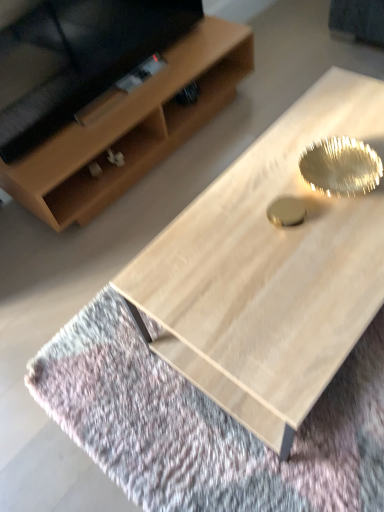
Question: Would you say light brown wood shelf at upper left is inside or outside light wood coffee table at center?

Choices:
 (A) inside
 (B) outside

Answer: (B)

Question: From a real-world perspective, is light brown wood shelf at upper left above or below light wood coffee table at center?

Choices:
 (A) above
 (B) below

Answer: (B)

Question: From the image's perspective, relative to light wood coffee table at center, is light brown wood shelf at upper left above or below?

Choices:
 (A) below
 (B) above

Answer: (B)

Question: Relative to light brown wood shelf at upper left, is light wood coffee table at center in front or behind?

Choices:
 (A) behind
 (B) front

Answer: (B)

Question: Is light wood coffee table at center taller or shorter than light brown wood shelf at upper left?

Choices:
 (A) short
 (B) tall

Answer: (B)

Question: Considering the positions of light wood coffee table at center and light brown wood shelf at upper left in the image, is light wood coffee table at center wider or thinner than light brown wood shelf at upper left?

Choices:
 (A) thin
 (B) wide

Answer: (B)

Question: From the image's perspective, relative to light brown wood shelf at upper left, is light wood coffee table at center above or below?

Choices:
 (A) above
 (B) below

Answer: (B)